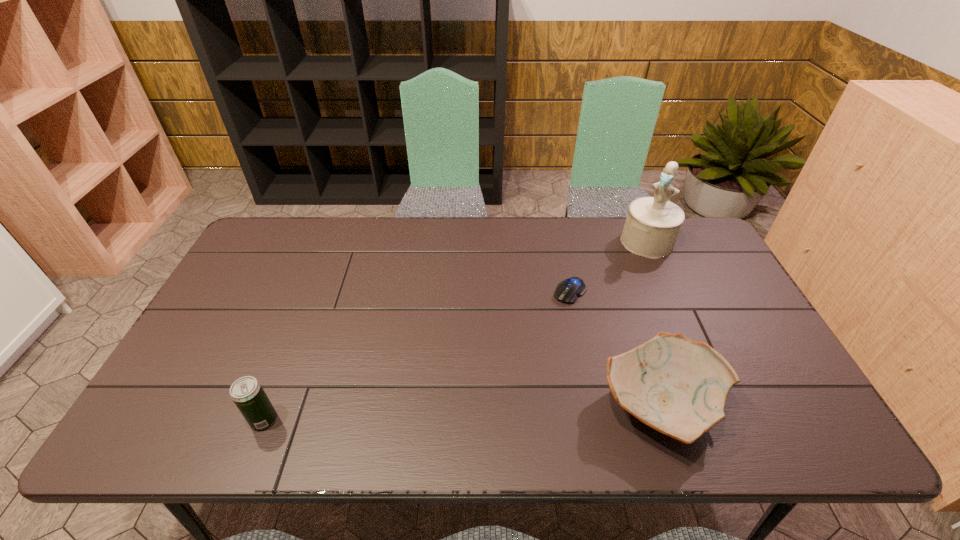
Find the location of a particular element. unoccupied area between the beer can and the pottery is located at coordinates (462, 413).

Image resolution: width=960 pixels, height=540 pixels. Identify the location of vacant area between the shortest object and the beer can. (417, 356).

The image size is (960, 540). What are the coordinates of `free space between the computer mouse and the beer can` in the screenshot? It's located at (417, 356).

Where is `vacant area that lies between the farthest object and the beer can`? This screenshot has width=960, height=540. vacant area that lies between the farthest object and the beer can is located at coordinates (455, 331).

Image resolution: width=960 pixels, height=540 pixels. In order to click on free space between the second shortest object and the computer mouse in this screenshot , I will do `click(614, 349)`.

Where is `the closest object relative to the figurine`? This screenshot has height=540, width=960. the closest object relative to the figurine is located at coordinates (567, 291).

Where is `the closest object to the second farthest object`? This screenshot has width=960, height=540. the closest object to the second farthest object is located at coordinates (652, 226).

Find the location of a particular element. free location that satisfies the following two spatial constraints: 1. on the back side of the pottery; 2. on the left side of the beer can is located at coordinates (269, 407).